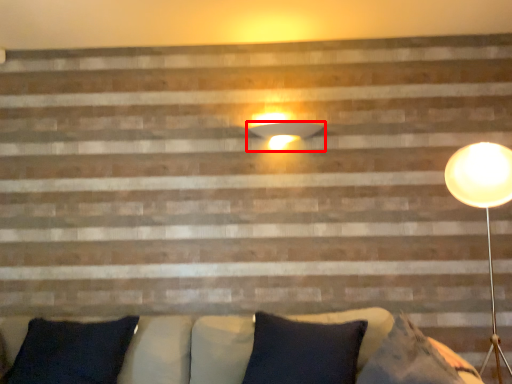
Question: From the image's perspective, what is the correct spatial relationship of lamp (annotated by the red box) in relation to pillow?

Choices:
 (A) above
 (B) below

Answer: (A)